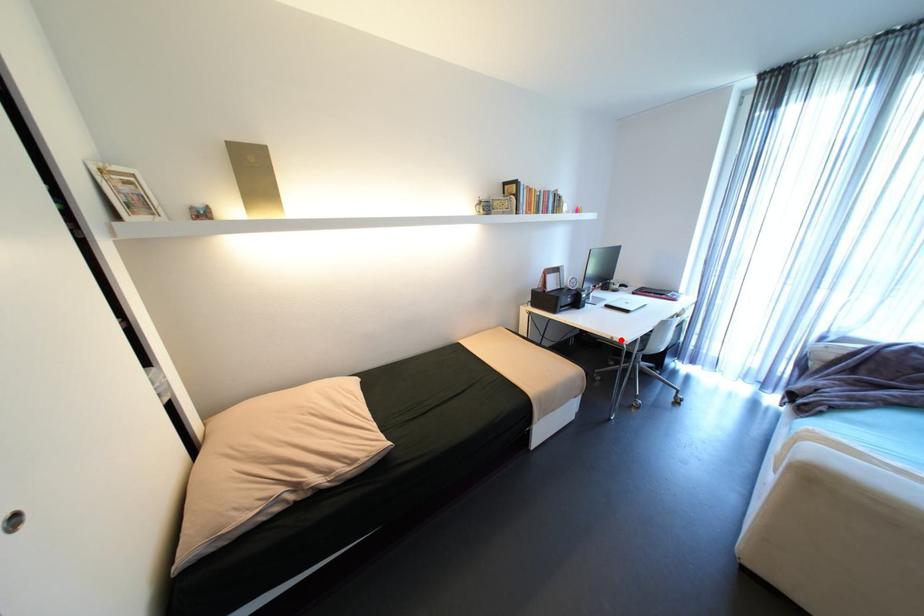
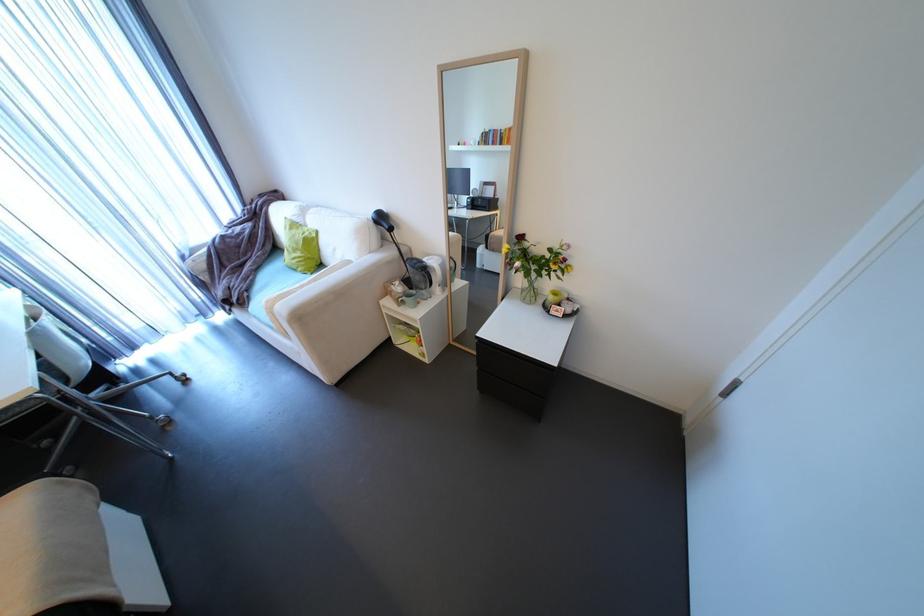
Locate, in the second image, the point that corresponds to the highlighted location in the first image.

(7, 408)